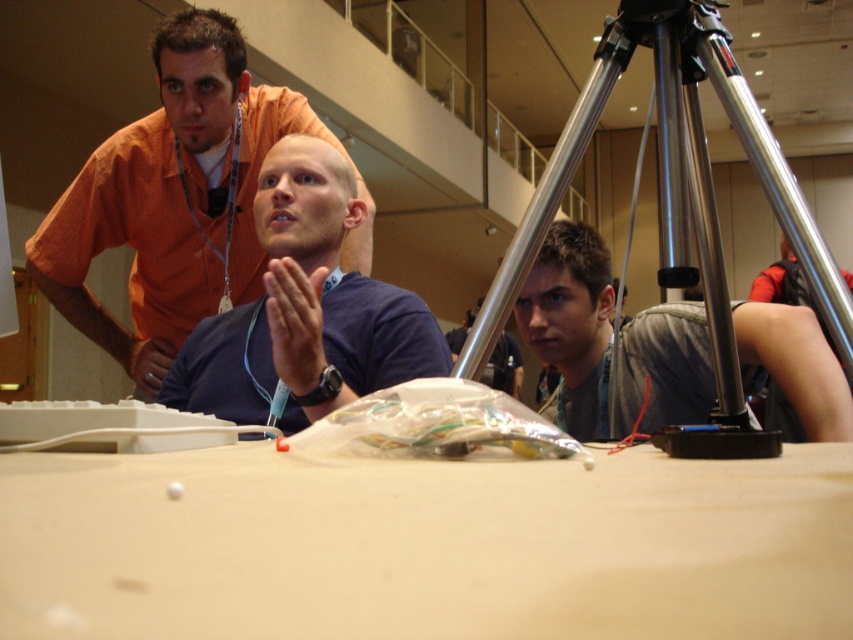
Question: Which point is farther from the camera taking this photo?

Choices:
 (A) (805, 404)
 (B) (318, 548)

Answer: (A)

Question: Which of the following is the farthest from the observer?

Choices:
 (A) white matte table at center
 (B) silver metallic tripod at center

Answer: (B)

Question: Is orange shirt at upper left above blue matte shirt at center?

Choices:
 (A) yes
 (B) no

Answer: (A)

Question: Which point is closer to the camera?

Choices:
 (A) (697, 634)
 (B) (186, 26)
 (C) (779, 323)
 (D) (308, 273)

Answer: (A)

Question: Can you confirm if white matte table at center is wider than orange shirt at upper left?

Choices:
 (A) yes
 (B) no

Answer: (B)

Question: Does silver metallic tripod at center have a lesser width compared to blue matte shirt at center?

Choices:
 (A) yes
 (B) no

Answer: (B)